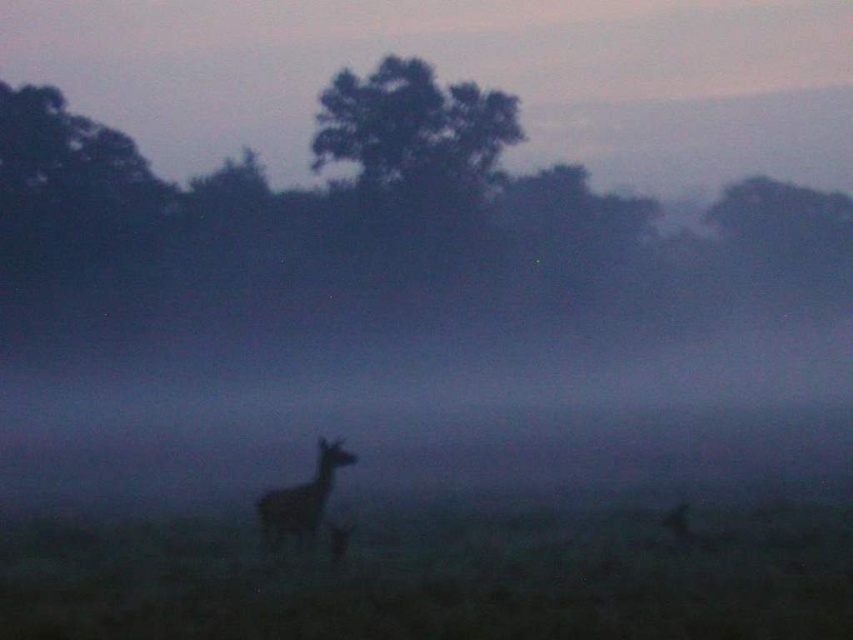
How distant is green leafy tree at upper center from silhouette fur deer at center?

A distance of 51.61 meters exists between green leafy tree at upper center and silhouette fur deer at center.

Between green leafy tree at upper center and silhouette fur deer at center, which one appears on the left side from the viewer's perspective?

green leafy tree at upper center is more to the left.

Which is in front, point (323, 157) or point (347, 456)?

Point (347, 456) is in front.

Find the location of a particular element. The image size is (853, 640). green leafy tree at upper center is located at coordinates (415, 134).